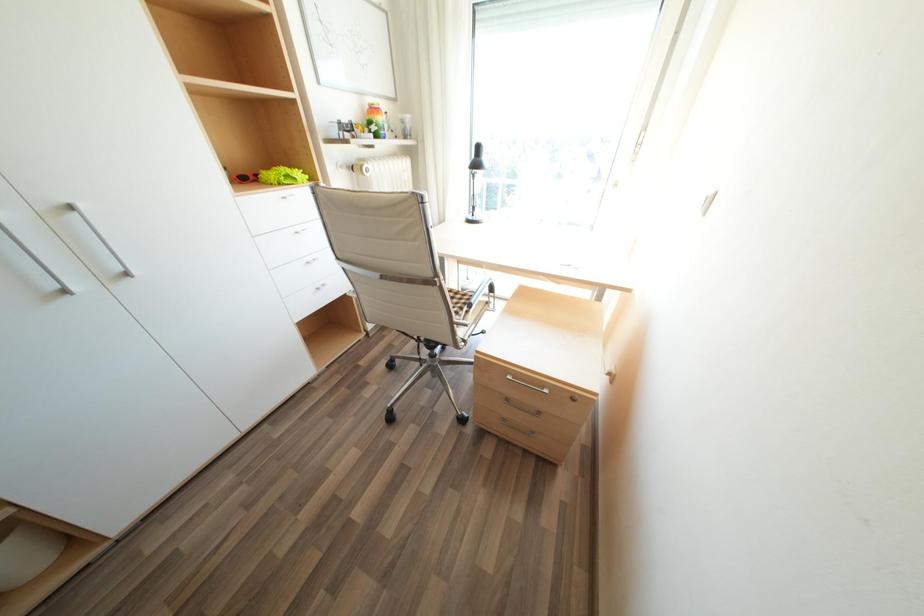
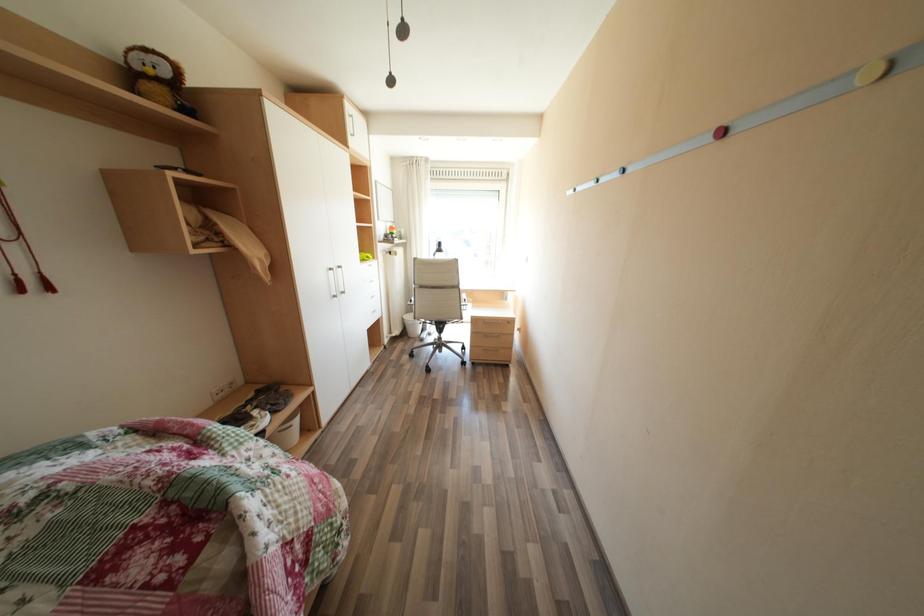
What movement of the cameraman would produce the second image?

The cameraman moved toward left, backward.